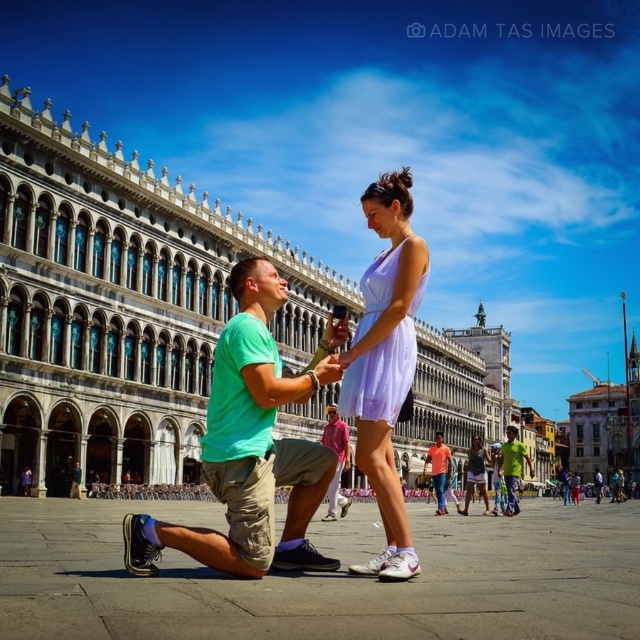
Is green matte t-shirt at center to the left of lavender satin dress at center from the viewer's perspective?

Indeed, green matte t-shirt at center is positioned on the left side of lavender satin dress at center.

Is green matte t-shirt at center below lavender satin dress at center?

Yes, green matte t-shirt at center is below lavender satin dress at center.

Is point (323, 362) behind point (362, 332)?

That is False.

Find the location of `green matte t-shirt at center`. green matte t-shirt at center is located at coordinates (252, 445).

Is point (352, 387) less distant than point (481, 454)?

Yes.

Which of these two, lavender satin dress at center or matte purple dress at center, stands shorter?

Standing shorter between the two is matte purple dress at center.

Does point (362, 461) lie behind point (467, 509)?

No, (362, 461) is in front of (467, 509).

I want to click on lavender satin dress at center, so click(385, 362).

Can you confirm if matte purple dress at center is shorter than orange cotton shirt at center?

In fact, matte purple dress at center may be taller than orange cotton shirt at center.

Identify the location of matte purple dress at center. (476, 474).

Where is `matte purple dress at center`? This screenshot has width=640, height=640. matte purple dress at center is located at coordinates (476, 474).

The height and width of the screenshot is (640, 640). In order to click on matte purple dress at center in this screenshot , I will do `click(476, 474)`.